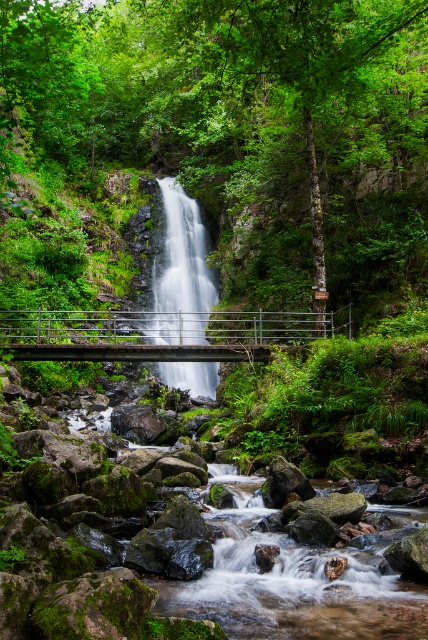
Question: Which of the following is the farthest from the observer?

Choices:
 (A) (130, 337)
 (B) (202, 236)

Answer: (B)

Question: Considering the real-world distances, which object is farthest from the green leafy forest at center?

Choices:
 (A) gray metallic bridge at center
 (B) translucent glass waterfall at center

Answer: (A)

Question: Does green leafy forest at center appear on the left side of gray metallic bridge at center?

Choices:
 (A) no
 (B) yes

Answer: (B)

Question: Which point appears closest to the camera in this image?

Choices:
 (A) (330, 304)
 (B) (208, 369)

Answer: (A)

Question: Is gray metallic bridge at center smaller than translucent glass waterfall at center?

Choices:
 (A) yes
 (B) no

Answer: (A)

Question: Does green leafy forest at center lie in front of translucent glass waterfall at center?

Choices:
 (A) yes
 (B) no

Answer: (A)